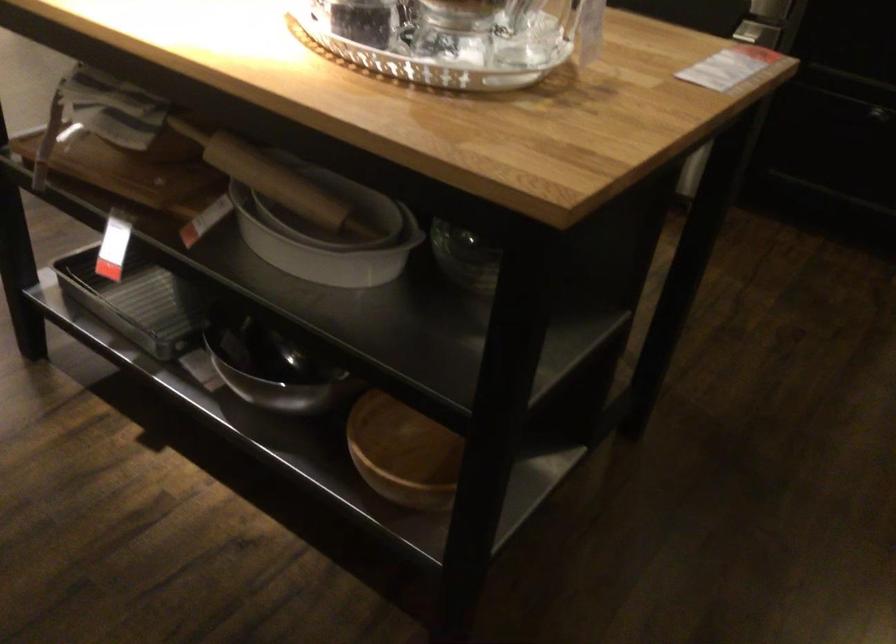
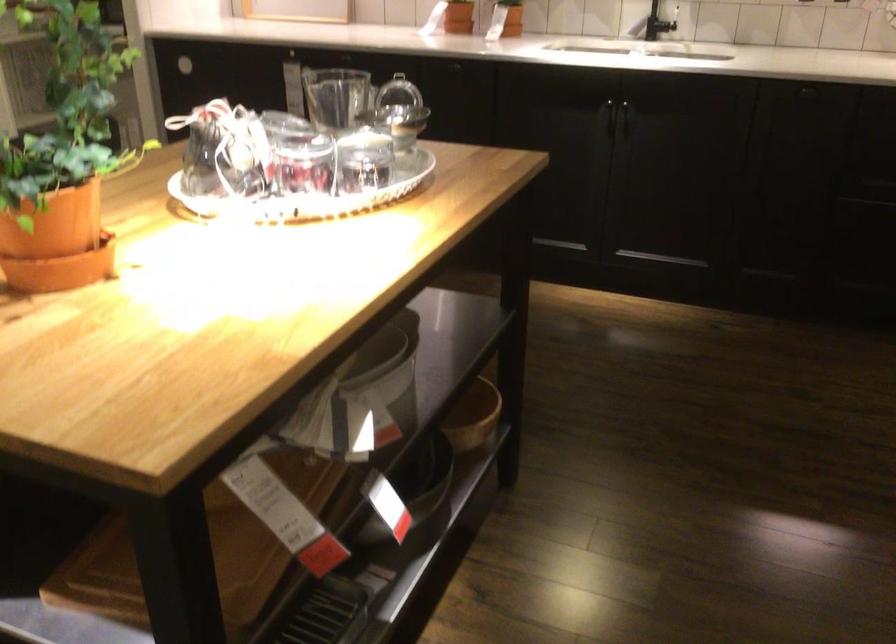
Find the pixel in the second image that matches point (105, 163) in the first image.

(362, 397)